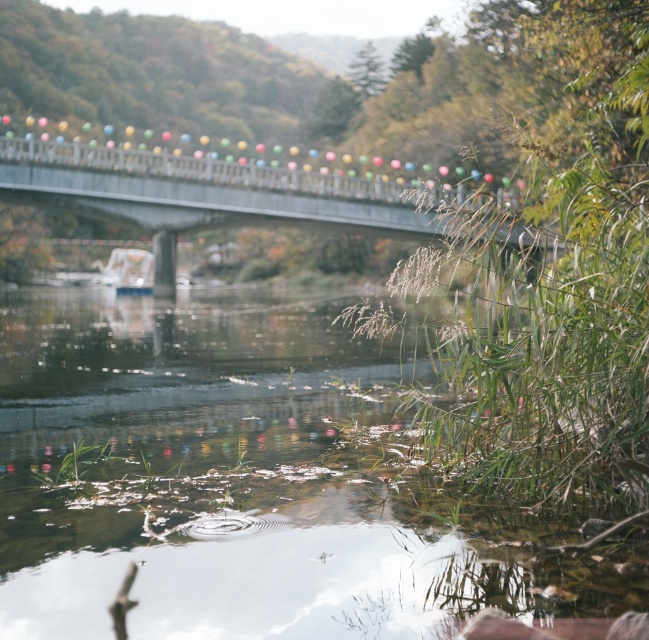
You are standing at the edge of the water and want to place a small floating decoration exactly at the point marked by the coordinates point (251, 483). According to the scene description, what is the nature of the water at that specific location?

The point marked by the coordinates point (251, 483) is translucent water at lower center, which means the water there is clear and allows visibility of the bottom, making it suitable for placing a floating decoration.

You are standing at the edge of the water and want to place a small floating decoration exactly 7 feet away from where you are standing. Can you confirm if the translucent water at lower center is within the desired distance for placing the decoration?

The translucent water at lower center is 7.16 feet away from viewer, so yes, it is within the desired 7 feet distance for placing the small floating decoration.

You are a photographer wanting to capture the reflection of the white plastic boat at center in the translucent water at lower center. Can you expect the reflection to be visible given their relative heights?

The translucent water at lower center has a lesser height compared to white plastic boat at center, so the reflection of the white plastic boat at center may not be fully visible or might appear distorted due to the water being lower in height.